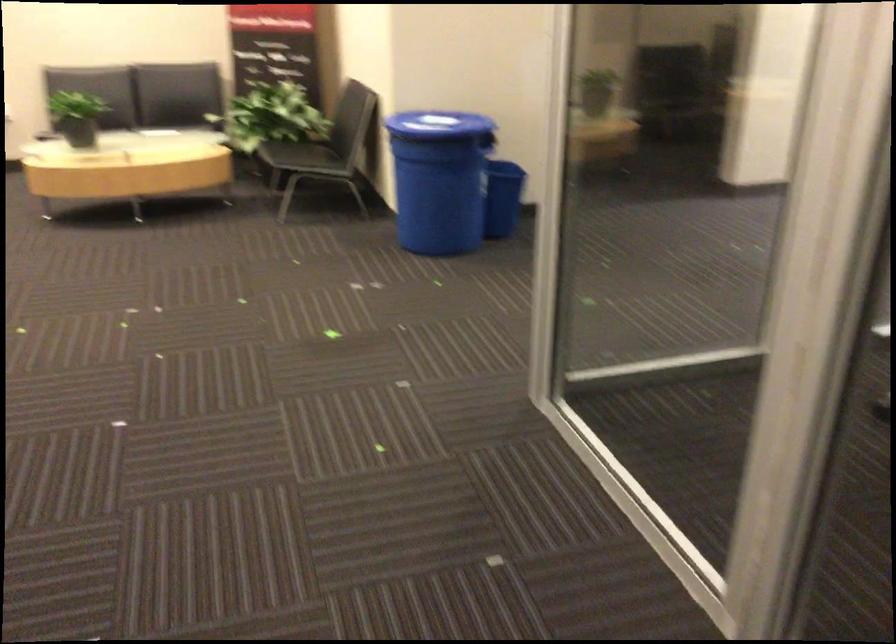
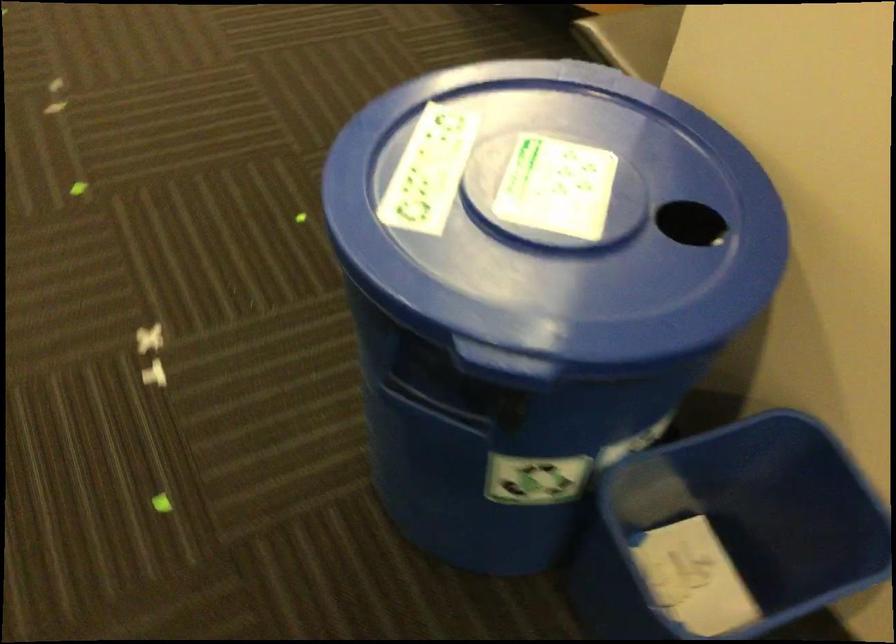
Find the pixel in the second image that matches point 483,140 in the first image.

(426, 406)